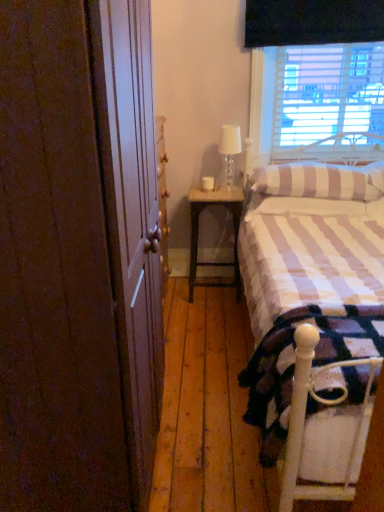
Question: Is striped fabric pillow at upper right not inside brown wood screen door at left?

Choices:
 (A) yes
 (B) no

Answer: (A)

Question: Is striped fabric pillow at upper right at the right side of brown wood screen door at left?

Choices:
 (A) no
 (B) yes

Answer: (B)

Question: From a real-world perspective, is striped fabric pillow at upper right positioned under brown wood screen door at left based on gravity?

Choices:
 (A) yes
 (B) no

Answer: (A)

Question: Would you say striped fabric pillow at upper right contains brown wood screen door at left?

Choices:
 (A) no
 (B) yes

Answer: (A)

Question: Is striped fabric pillow at upper right smaller than brown wood screen door at left?

Choices:
 (A) no
 (B) yes

Answer: (B)

Question: Is striped fabric pillow at upper right next to brown wood screen door at left?

Choices:
 (A) yes
 (B) no

Answer: (B)

Question: Is brown wood screen door at left turned away from white textured bed at right?

Choices:
 (A) yes
 (B) no

Answer: (B)

Question: From the image's perspective, is brown wood screen door at left above white textured bed at right?

Choices:
 (A) no
 (B) yes

Answer: (B)

Question: From a real-world perspective, is brown wood screen door at left on top of white textured bed at right?

Choices:
 (A) no
 (B) yes

Answer: (B)

Question: From a real-world perspective, does brown wood screen door at left sit lower than white textured bed at right?

Choices:
 (A) no
 (B) yes

Answer: (A)

Question: Does brown wood screen door at left have a lesser width compared to white textured bed at right?

Choices:
 (A) no
 (B) yes

Answer: (B)

Question: Can you confirm if brown wood screen door at left is smaller than white textured bed at right?

Choices:
 (A) yes
 (B) no

Answer: (A)

Question: Is striped fabric pillow at upper right shorter than white metal bed frame at lower right?

Choices:
 (A) no
 (B) yes

Answer: (B)